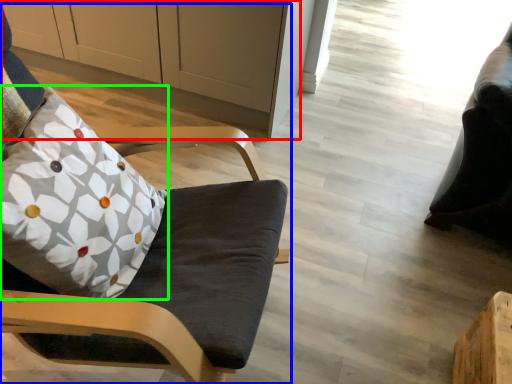
Question: Which is farther away from cabinetry (highlighted by a red box)? chair (highlighted by a blue box) or pillow (highlighted by a green box)?

Choices:
 (A) chair
 (B) pillow

Answer: (B)